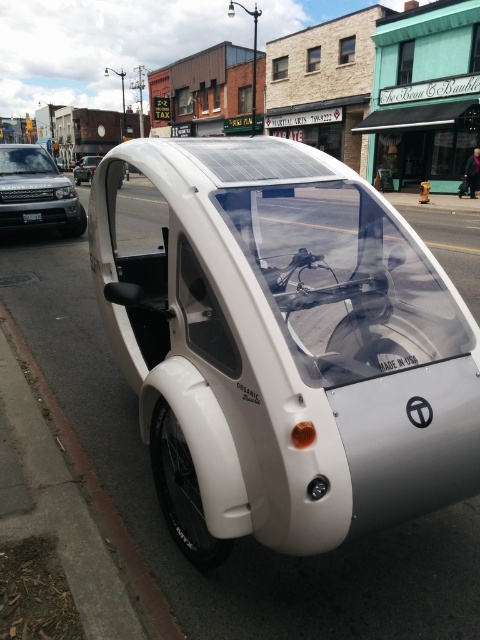
Question: Which object is farther from the camera taking this photo?

Choices:
 (A) white matte coach at center
 (B) white matte concept car at center
 (C) matte black car at left
 (D) white plastic license plate at center

Answer: (C)

Question: Can you confirm if matte black car at left is positioned below white plastic license plate at center?

Choices:
 (A) yes
 (B) no

Answer: (B)

Question: Is white matte concept car at center wider than silver metallic suv at left?

Choices:
 (A) no
 (B) yes

Answer: (A)

Question: Is white matte coach at center above white plastic license plate at center?

Choices:
 (A) no
 (B) yes

Answer: (B)

Question: Which object is positioned closest to the silver metallic suv at left?

Choices:
 (A) white plastic license plate at center
 (B) white matte coach at center
 (C) white matte concept car at center

Answer: (A)

Question: Which point is closer to the camera?

Choices:
 (A) white plastic license plate at center
 (B) matte black car at left
 (C) silver metallic suv at left
 (D) white matte concept car at center

Answer: (D)